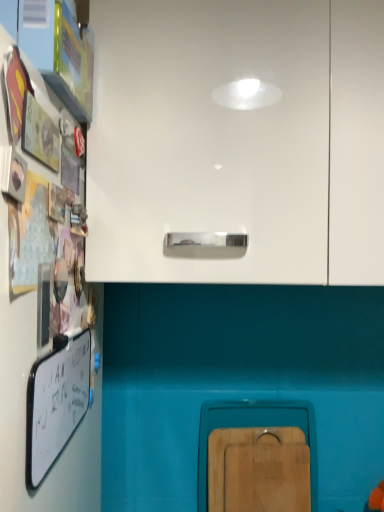
Where is `white glossy cabinet at upper center, arranged as the first cabinetry when viewed from the front`? The width and height of the screenshot is (384, 512). white glossy cabinet at upper center, arranged as the first cabinetry when viewed from the front is located at coordinates [237, 140].

Locate an element on the screen. whiteboard at left is located at coordinates (56, 402).

This screenshot has width=384, height=512. I want to click on wooden cutting board at lower center, positioned as the second cabinetry in front-to-back order, so click(257, 456).

Which is in front, whiteboard at left or white glossy cabinet at upper center, which is counted as the second cabinetry, starting from the back?

whiteboard at left is more forward.

Considering the relative sizes of whiteboard at left and white glossy cabinet at upper center, arranged as the first cabinetry when viewed from the front, in the image provided, is whiteboard at left smaller than white glossy cabinet at upper center, arranged as the first cabinetry when viewed from the front,?

Correct, whiteboard at left occupies less space than white glossy cabinet at upper center, arranged as the first cabinetry when viewed from the front.

Which is more to the left, whiteboard at left or white glossy cabinet at upper center, acting as the 1th cabinetry starting from the top?

From the viewer's perspective, whiteboard at left appears more on the left side.

Can you confirm if white glossy cabinet at upper center, marked as the 2th cabinetry in a bottom-to-top arrangement, is wider than wooden cutting board at lower center, arranged as the 1th cabinetry when ordered from the bottom?

Yes.

Between white glossy cabinet at upper center, arranged as the first cabinetry when viewed from the front, and wooden cutting board at lower center, placed as the 1th cabinetry when sorted from back to front, which one has more height?

Standing taller between the two is white glossy cabinet at upper center, arranged as the first cabinetry when viewed from the front.

Measure the distance between white glossy cabinet at upper center, marked as the 2th cabinetry in a bottom-to-top arrangement, and wooden cutting board at lower center, arranged as the 1th cabinetry when ordered from the bottom.

white glossy cabinet at upper center, marked as the 2th cabinetry in a bottom-to-top arrangement, is 23.04 inches from wooden cutting board at lower center, arranged as the 1th cabinetry when ordered from the bottom.

How different are the orientations of white glossy cabinet at upper center, acting as the 1th cabinetry starting from the top, and wooden cutting board at lower center, positioned as the second cabinetry in front-to-back order, in degrees?

2 degrees.

Does point (218, 486) lie behind point (28, 404)?

Yes, point (218, 486) is farther from viewer.

In the image, there is a whiteboard at left. At what (x,y) coordinates should I click in order to perform the action: click on cabinetry below it (from a real-world perspective). Please return your answer as a coordinate pair (x, y). Looking at the image, I should click on (257, 456).

Considering the positions of objects wooden cutting board at lower center, arranged as the 2th cabinetry when viewed from the top, and whiteboard at left in the image provided, who is more to the left, wooden cutting board at lower center, arranged as the 2th cabinetry when viewed from the top, or whiteboard at left?

Positioned to the left is whiteboard at left.

From the image's perspective, which is below, wooden cutting board at lower center, positioned as the second cabinetry in front-to-back order, or white glossy cabinet at upper center, which is counted as the second cabinetry, starting from the back?

wooden cutting board at lower center, positioned as the second cabinetry in front-to-back order, appears lower in the image.

Which object is positioned more to the left, wooden cutting board at lower center, arranged as the 1th cabinetry when ordered from the bottom, or white glossy cabinet at upper center, arranged as the first cabinetry when viewed from the front?

white glossy cabinet at upper center, arranged as the first cabinetry when viewed from the front.

Between wooden cutting board at lower center, arranged as the 2th cabinetry when viewed from the top, and white glossy cabinet at upper center, acting as the 1th cabinetry starting from the top, which one has larger width?

white glossy cabinet at upper center, acting as the 1th cabinetry starting from the top, is wider.

Find the location of `cabinetry behind the white glossy cabinet at upper center, marked as the 2th cabinetry in a bottom-to-top arrangement`. cabinetry behind the white glossy cabinet at upper center, marked as the 2th cabinetry in a bottom-to-top arrangement is located at coordinates (257, 456).

Considering the positions of point (29, 429) and point (203, 439), is point (29, 429) closer or farther from the camera than point (203, 439)?

Point (29, 429) is positioned closer to the camera compared to point (203, 439).

How different are the orientations of whiteboard at left and wooden cutting board at lower center, arranged as the 1th cabinetry when ordered from the bottom, in degrees?

The angular difference between whiteboard at left and wooden cutting board at lower center, arranged as the 1th cabinetry when ordered from the bottom, is 87.2 degrees.

From the image's perspective, which object appears higher, whiteboard at left or wooden cutting board at lower center, positioned as the second cabinetry in front-to-back order?

whiteboard at left, from the image's perspective.

Considering the relative sizes of white glossy cabinet at upper center, acting as the 1th cabinetry starting from the top, and whiteboard at left in the image provided, is white glossy cabinet at upper center, acting as the 1th cabinetry starting from the top, wider than whiteboard at left?

Correct, the width of white glossy cabinet at upper center, acting as the 1th cabinetry starting from the top, exceeds that of whiteboard at left.

Is white glossy cabinet at upper center, acting as the 1th cabinetry starting from the top, not close to whiteboard at left?

No.

From the image's perspective, is white glossy cabinet at upper center, arranged as the first cabinetry when viewed from the front, located beneath whiteboard at left?

No, from the image's perspective, white glossy cabinet at upper center, arranged as the first cabinetry when viewed from the front, is not below whiteboard at left.

Find the location of a particular element. The height and width of the screenshot is (512, 384). whiteboard beneath the white glossy cabinet at upper center, arranged as the first cabinetry when viewed from the front (from a real-world perspective) is located at coordinates (56, 402).

Find the location of `whiteboard lying on the left of white glossy cabinet at upper center, arranged as the first cabinetry when viewed from the front`. whiteboard lying on the left of white glossy cabinet at upper center, arranged as the first cabinetry when viewed from the front is located at coordinates (56, 402).

The width and height of the screenshot is (384, 512). In the image, there is a wooden cutting board at lower center, positioned as the second cabinetry in front-to-back order. Identify the location of cabinetry above it (from the image's perspective). (237, 140).

When comparing their distances from wooden cutting board at lower center, arranged as the 2th cabinetry when viewed from the top, does whiteboard at left or white glossy cabinet at upper center, acting as the 1th cabinetry starting from the top, seem further?

Based on the image, white glossy cabinet at upper center, acting as the 1th cabinetry starting from the top, appears to be further to wooden cutting board at lower center, arranged as the 2th cabinetry when viewed from the top.

Estimate the real-world distances between objects in this image. Which object is closer to wooden cutting board at lower center, placed as the 1th cabinetry when sorted from back to front, white glossy cabinet at upper center, acting as the 1th cabinetry starting from the top, or whiteboard at left?

whiteboard at left lies closer to wooden cutting board at lower center, placed as the 1th cabinetry when sorted from back to front, than the other object.

Looking at the image, which one is located closer to white glossy cabinet at upper center, acting as the 1th cabinetry starting from the top, whiteboard at left or wooden cutting board at lower center, placed as the 1th cabinetry when sorted from back to front?

whiteboard at left.

Estimate the real-world distances between objects in this image. Which object is closer to whiteboard at left, wooden cutting board at lower center, positioned as the second cabinetry in front-to-back order, or white glossy cabinet at upper center, arranged as the first cabinetry when viewed from the front?

wooden cutting board at lower center, positioned as the second cabinetry in front-to-back order.

Estimate the real-world distances between objects in this image. Which object is further from whiteboard at left, white glossy cabinet at upper center, which is counted as the second cabinetry, starting from the back, or wooden cutting board at lower center, placed as the 1th cabinetry when sorted from back to front?

Among the two, white glossy cabinet at upper center, which is counted as the second cabinetry, starting from the back, is located further to whiteboard at left.

Looking at the image, which one is located closer to white glossy cabinet at upper center, acting as the 1th cabinetry starting from the top, wooden cutting board at lower center, positioned as the second cabinetry in front-to-back order, or whiteboard at left?

Among the two, whiteboard at left is located nearer to white glossy cabinet at upper center, acting as the 1th cabinetry starting from the top.

Locate an element on the screen. Image resolution: width=384 pixels, height=512 pixels. whiteboard between white glossy cabinet at upper center, acting as the 1th cabinetry starting from the top, and wooden cutting board at lower center, arranged as the 1th cabinetry when ordered from the bottom, in the vertical direction is located at coordinates (56, 402).